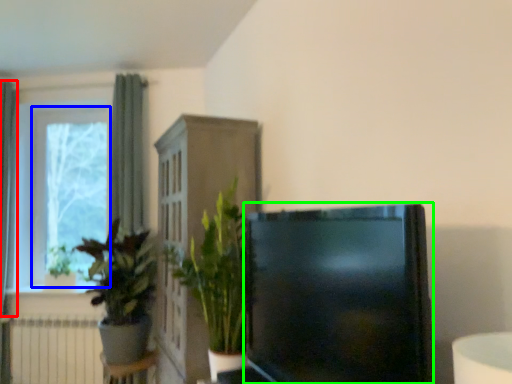
Question: Based on their relative distances, which object is nearer to curtain (highlighted by a red box)? Choose from window frame (highlighted by a blue box) and television (highlighted by a green box).

Choices:
 (A) window frame
 (B) television

Answer: (A)